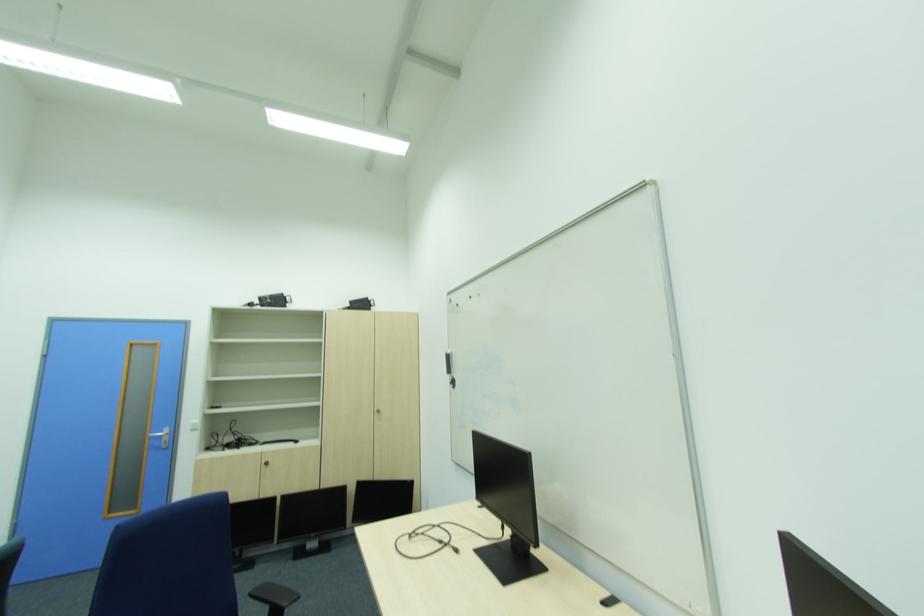
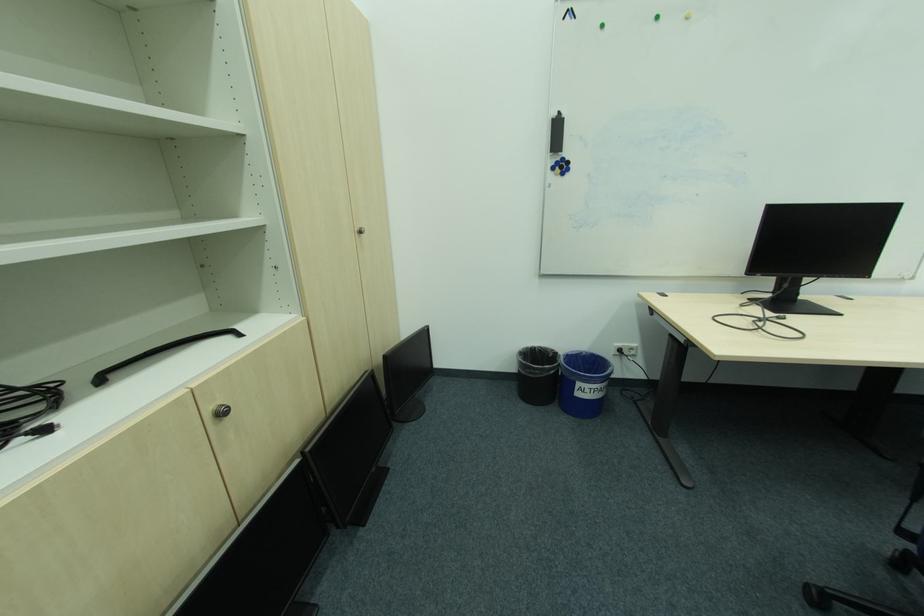
Find the pixel in the second image that matches [458,381] in the first image.

(565, 163)